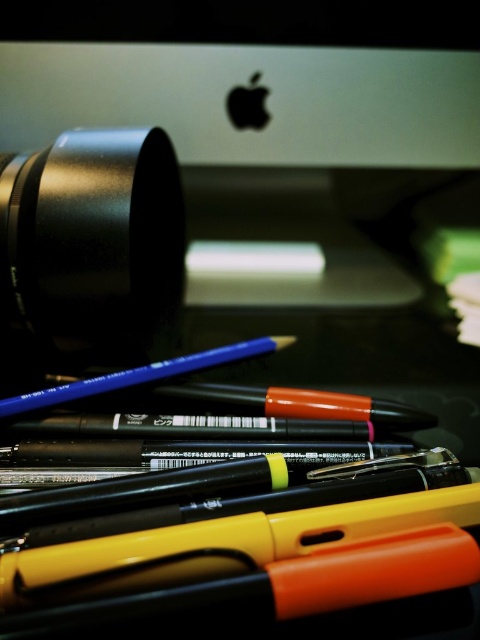
Question: Which of the following is the farthest from the observer?

Choices:
 (A) (169, 118)
 (B) (129, 259)

Answer: (A)

Question: Can you confirm if sleek silver desktop at upper center is smaller than black matte camera lens at upper left?

Choices:
 (A) no
 (B) yes

Answer: (A)

Question: Which point is closer to the camera?

Choices:
 (A) (29, 132)
 (B) (58, 156)

Answer: (B)

Question: Does sleek silver desktop at upper center appear over black matte camera lens at upper left?

Choices:
 (A) no
 (B) yes

Answer: (B)

Question: Does sleek silver desktop at upper center appear on the right side of black matte camera lens at upper left?

Choices:
 (A) no
 (B) yes

Answer: (B)